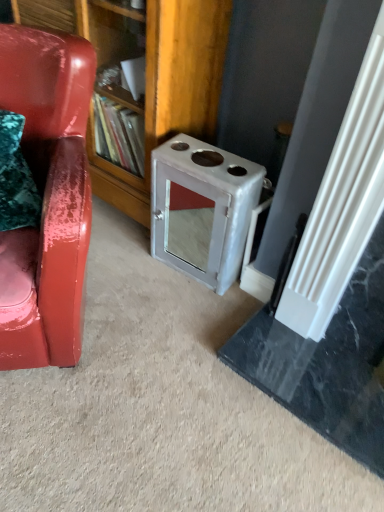
Question: Considering the relative sizes of glossy leather chair at left and wooden bookshelf at center in the image provided, is glossy leather chair at left taller than wooden bookshelf at center?

Choices:
 (A) no
 (B) yes

Answer: (A)

Question: From a real-world perspective, is glossy leather chair at left on wooden bookshelf at center?

Choices:
 (A) yes
 (B) no

Answer: (B)

Question: Does glossy leather chair at left have a lesser height compared to wooden bookshelf at center?

Choices:
 (A) yes
 (B) no

Answer: (A)

Question: Is glossy leather chair at left behind wooden bookshelf at center?

Choices:
 (A) yes
 (B) no

Answer: (B)

Question: Would you say glossy leather chair at left contains wooden bookshelf at center?

Choices:
 (A) yes
 (B) no

Answer: (B)

Question: From the image's perspective, is glossy leather chair at left below wooden bookshelf at center?

Choices:
 (A) no
 (B) yes

Answer: (B)

Question: Is glossy leather chair at left at the right side of metallic gray stove at center-right?

Choices:
 (A) yes
 (B) no

Answer: (B)

Question: Is glossy leather chair at left beside metallic gray stove at center-right?

Choices:
 (A) yes
 (B) no

Answer: (B)

Question: Is glossy leather chair at left looking in the opposite direction of metallic gray stove at center-right?

Choices:
 (A) no
 (B) yes

Answer: (A)

Question: Is glossy leather chair at left at the left side of metallic gray stove at center-right?

Choices:
 (A) no
 (B) yes

Answer: (B)

Question: Is glossy leather chair at left positioned far away from metallic gray stove at center-right?

Choices:
 (A) yes
 (B) no

Answer: (B)

Question: Is glossy leather chair at left aimed at metallic gray stove at center-right?

Choices:
 (A) no
 (B) yes

Answer: (A)

Question: Is the position of wooden bookshelf at center more distant than that of glossy leather chair at left?

Choices:
 (A) no
 (B) yes

Answer: (B)